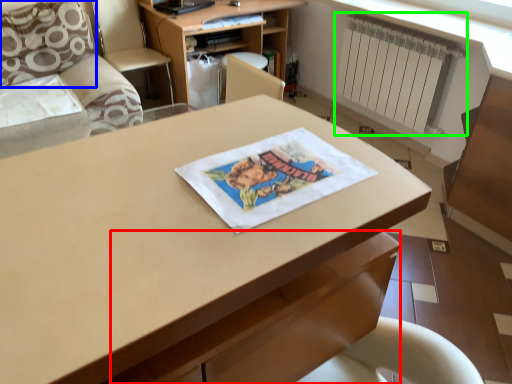
Question: Which object is positioned closest to drawer (highlighted by a red box)? Select from pillow (highlighted by a blue box) and radiator (highlighted by a green box).

Choices:
 (A) pillow
 (B) radiator

Answer: (B)